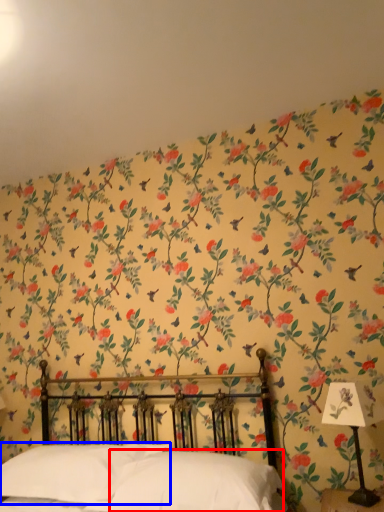
Question: Which object is closer to the camera taking this photo, pillow (highlighted by a red box) or pillow (highlighted by a blue box)?

Choices:
 (A) pillow
 (B) pillow

Answer: (A)